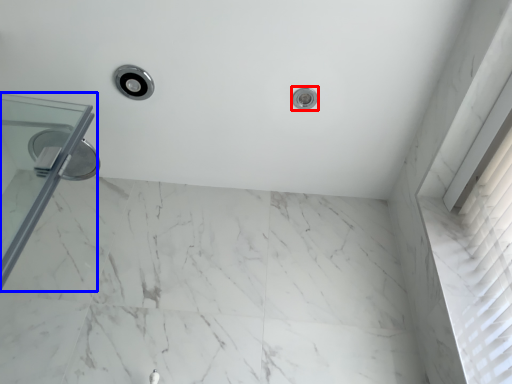
Question: Among these objects, which one is farthest to the camera, shower (highlighted by a red box) or glass door (highlighted by a blue box)?

Choices:
 (A) shower
 (B) glass door

Answer: (A)